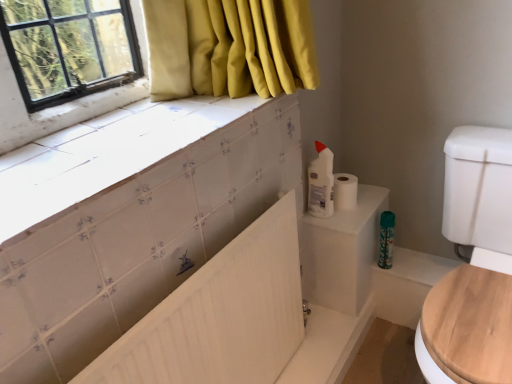
Question: Considering the relative sizes of wooden at right and green plastic spray bottle at lower right, the 2th cleaning product when ordered from top to bottom, in the image provided, is wooden at right thinner than green plastic spray bottle at lower right, the 2th cleaning product when ordered from top to bottom,?

Choices:
 (A) no
 (B) yes

Answer: (A)

Question: Is wooden at right next to green plastic spray bottle at lower right, positioned as the second cleaning product in left-to-right order, and touching it?

Choices:
 (A) yes
 (B) no

Answer: (B)

Question: From a real-world perspective, is wooden at right beneath green plastic spray bottle at lower right, the 2th cleaning product when ordered from top to bottom?

Choices:
 (A) no
 (B) yes

Answer: (A)

Question: From a real-world perspective, is wooden at right on top of green plastic spray bottle at lower right, the 1th cleaning product from the right?

Choices:
 (A) no
 (B) yes

Answer: (B)

Question: Considering the relative sizes of wooden at right and green plastic spray bottle at lower right, acting as the 1th cleaning product starting from the bottom, in the image provided, is wooden at right smaller than green plastic spray bottle at lower right, acting as the 1th cleaning product starting from the bottom,?

Choices:
 (A) no
 (B) yes

Answer: (A)

Question: Is wooden at right bigger than green plastic spray bottle at lower right, which is counted as the 2th cleaning product, starting from the front?

Choices:
 (A) yes
 (B) no

Answer: (A)

Question: Would you say white matte toilet paper at upper right is a long distance from green plastic spray bottle at lower right, which is counted as the 2th cleaning product, starting from the front?

Choices:
 (A) yes
 (B) no

Answer: (B)

Question: Are white matte toilet paper at upper right and green plastic spray bottle at lower right, positioned as the second cleaning product in left-to-right order, beside each other?

Choices:
 (A) no
 (B) yes

Answer: (A)

Question: From the image's perspective, is white matte toilet paper at upper right under green plastic spray bottle at lower right, positioned as the second cleaning product in left-to-right order?

Choices:
 (A) no
 (B) yes

Answer: (A)

Question: Can you confirm if white matte toilet paper at upper right is smaller than green plastic spray bottle at lower right, acting as the 1th cleaning product starting from the bottom?

Choices:
 (A) no
 (B) yes

Answer: (A)

Question: Is white matte toilet paper at upper right not within green plastic spray bottle at lower right, the 2th cleaning product when ordered from top to bottom?

Choices:
 (A) no
 (B) yes

Answer: (B)

Question: Is green plastic spray bottle at lower right, which is counted as the 2th cleaning product, starting from the front, completely or partially inside white matte toilet paper at upper right?

Choices:
 (A) yes
 (B) no

Answer: (B)

Question: Is white plastic bottle at upper right, which is counted as the 1th cleaning product, starting from the top, completely or partially outside of white glossy tile at upper left?

Choices:
 (A) yes
 (B) no

Answer: (A)